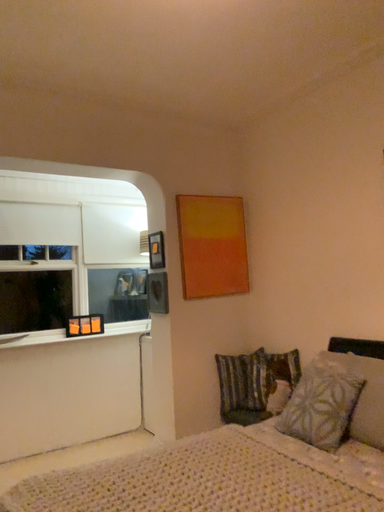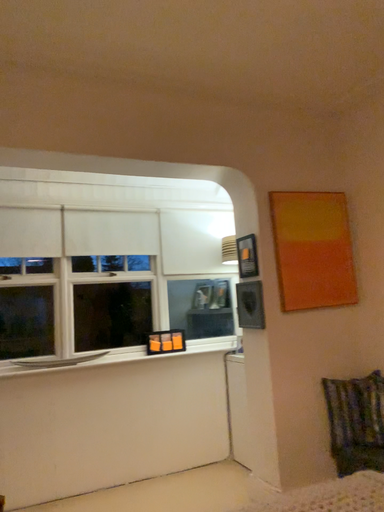
Question: How did the camera likely rotate when shooting the video?

Choices:
 (A) rotated left
 (B) rotated right

Answer: (A)